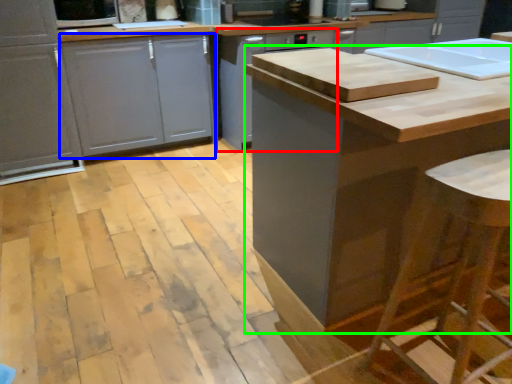
Question: Estimate the real-world distances between objects in this image. Which object is farther from cabinetry (highlighted by a red box), drawer (highlighted by a blue box) or cabinetry (highlighted by a green box)?

Choices:
 (A) drawer
 (B) cabinetry

Answer: (B)